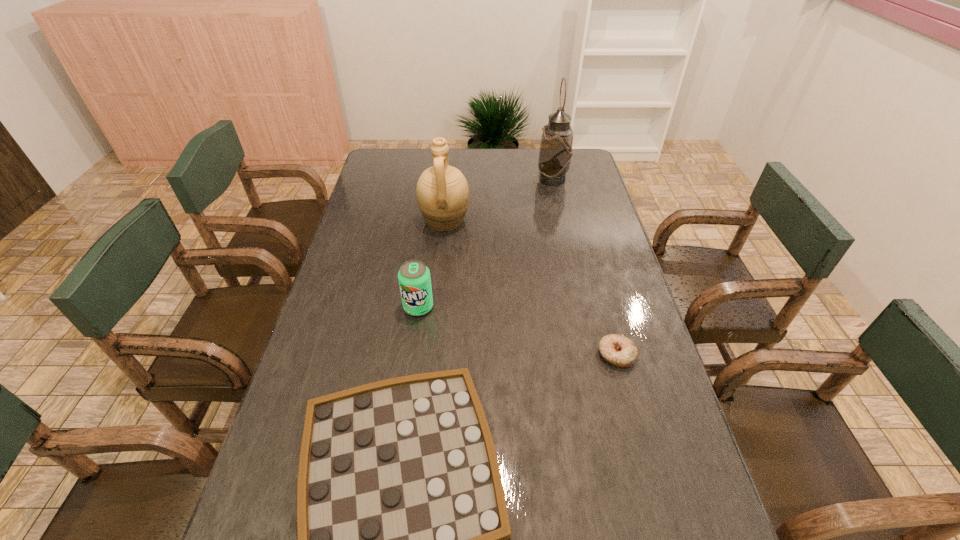
Find the location of a particular element. The width and height of the screenshot is (960, 540). vacant area that lies between the pop soda and the oil lamp is located at coordinates (486, 243).

You are a GUI agent. You are given a task and a screenshot of the screen. Output one action in this format:
    pyautogui.click(x=<x>, y=<y>)
    Task: Click on the free area in between the third farthest object and the second shortest object
    
    Given the screenshot: What is the action you would take?
    pyautogui.click(x=517, y=331)

At what (x,y) coordinates should I click in order to perform the action: click on vacant area that lies between the second nearest object and the fourth nearest object. Please return your answer as a coordinate pair (x, y). Image resolution: width=960 pixels, height=540 pixels. Looking at the image, I should click on (531, 288).

This screenshot has height=540, width=960. I want to click on vacant point located between the doughnut and the oil lamp, so click(x=585, y=267).

Locate an element on the screen. Image resolution: width=960 pixels, height=540 pixels. empty space between the third tallest object and the fourth nearest object is located at coordinates (432, 264).

You are a GUI agent. You are given a task and a screenshot of the screen. Output one action in this format:
    pyautogui.click(x=<x>, y=<y>)
    Task: Click on the empty space between the third nearest object and the oil lamp
    This screenshot has width=960, height=540.
    Given the screenshot: What is the action you would take?
    pyautogui.click(x=486, y=243)

Select which object is the third closest to the second nearest object. Please provide its 2D coordinates. Your answer should be formatted as a tuple, i.e. [(x, y)], where the tuple contains the x and y coordinates of a point satisfying the conditions above.

[(442, 191)]

Select which object appears as the closest to the tallest object. Please provide its 2D coordinates. Your answer should be formatted as a tuple, i.e. [(x, y)], where the tuple contains the x and y coordinates of a point satisfying the conditions above.

[(442, 191)]

Where is `free spot that satisfies the following two spatial constraints: 1. on the front-facing side of the third nearest object; 2. on the left side of the doughnut`? free spot that satisfies the following two spatial constraints: 1. on the front-facing side of the third nearest object; 2. on the left side of the doughnut is located at coordinates (412, 355).

Locate an element on the screen. Image resolution: width=960 pixels, height=540 pixels. free space that satisfies the following two spatial constraints: 1. on the front-facing side of the third shortest object; 2. on the right side of the second shortest object is located at coordinates (412, 355).